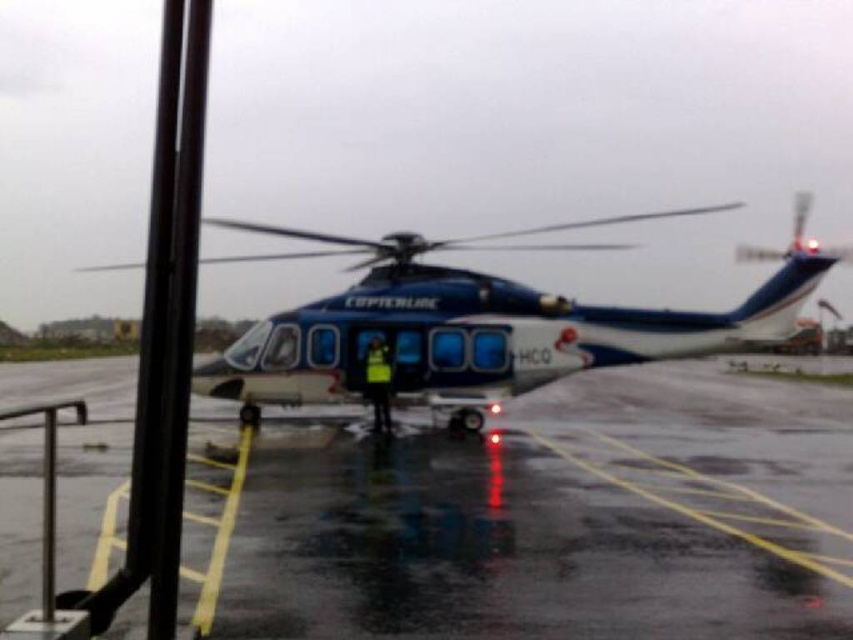
Question: Can you confirm if glossy asphalt tarmac at center is smaller than blue glossy helicopter at center?

Choices:
 (A) no
 (B) yes

Answer: (B)

Question: Is glossy asphalt tarmac at center wider than blue glossy helicopter at center?

Choices:
 (A) no
 (B) yes

Answer: (A)

Question: Can you confirm if glossy asphalt tarmac at center is smaller than blue glossy helicopter at center?

Choices:
 (A) yes
 (B) no

Answer: (A)

Question: Among these points, which one is nearest to the camera?

Choices:
 (A) (426, 296)
 (B) (635, 508)

Answer: (B)